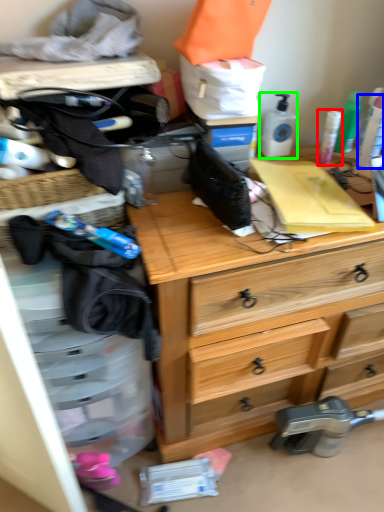
Question: Which object is the closest to the toiletry (highlighted by a red box)? Choose among these: toiletry (highlighted by a blue box) or toiletry (highlighted by a green box).

Choices:
 (A) toiletry
 (B) toiletry

Answer: (A)